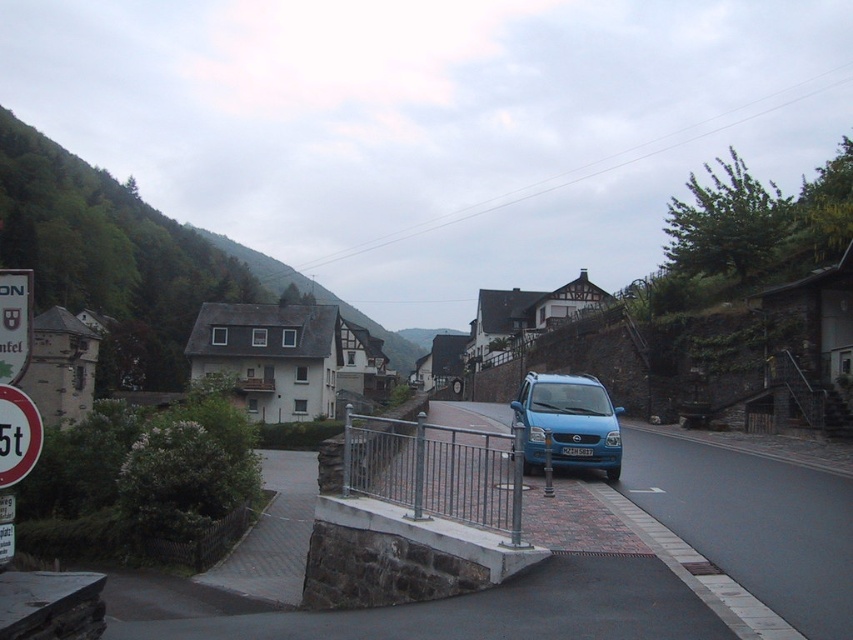
From the picture: You are standing on the paved road in the village scene and want to take a photo of both the green leafy hillside at upper left and the metallic gray rail at center. Which object should you position to the left side in your camera frame?

The green leafy hillside at upper left is positioned on the left side of the metallic gray rail at center, so you should place the green leafy hillside at upper left to the left side in your camera frame.

You are standing at the center of the road in the village scene. You want to take a photo of the green leafy hillside at upper left. Which direction should you face to capture it in your view?

The green leafy hillside at upper left is located at point upper left, so you should face towards the upper left direction to capture it in your view.